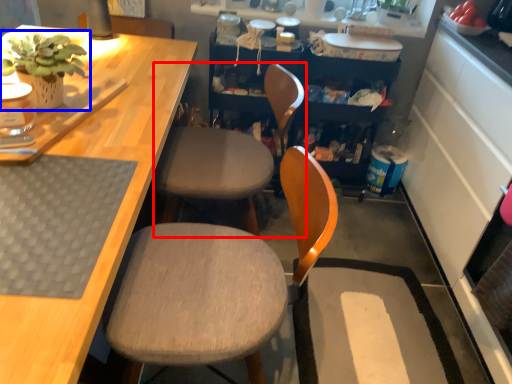
Question: Which of the following is the farthest to the observer, chair (highlighted by a red box) or houseplant (highlighted by a blue box)?

Choices:
 (A) chair
 (B) houseplant

Answer: (A)